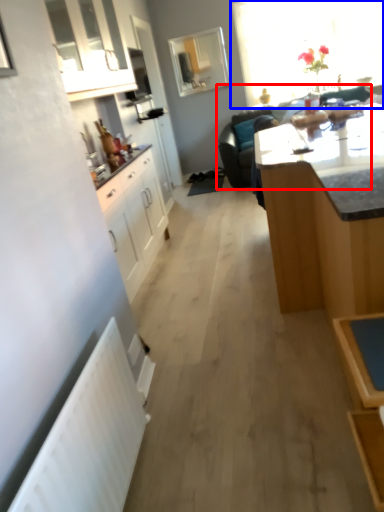
Question: Which object appears closest to the camera in this image, studio couch (highlighted by a red box) or window (highlighted by a blue box)?

Choices:
 (A) studio couch
 (B) window

Answer: (A)